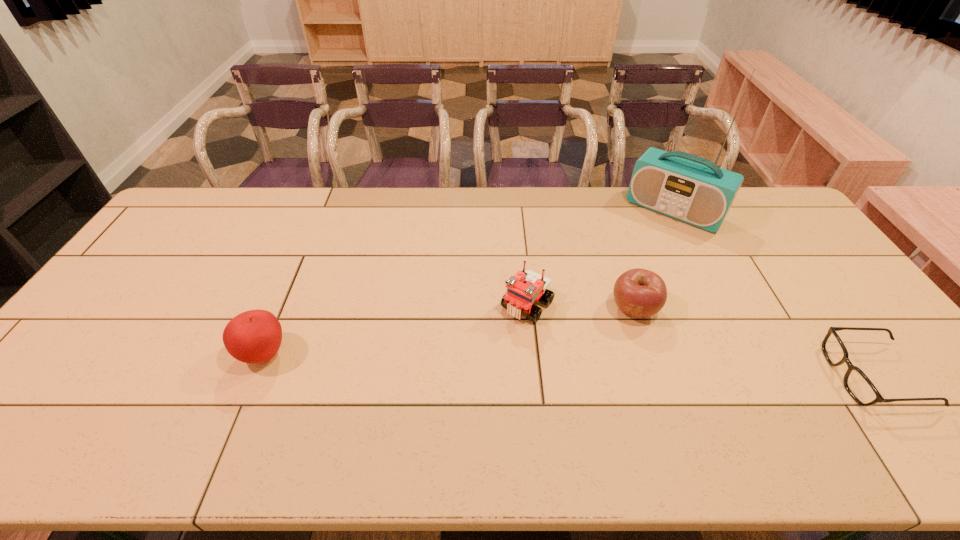
In order to click on vacant space on the desktop that is between the leftmost object and the rightmost object and is positioned on the front panel of the radio receiver in this screenshot , I will do `click(563, 364)`.

You are a GUI agent. You are given a task and a screenshot of the screen. Output one action in this format:
    pyautogui.click(x=<x>, y=<y>)
    Task: Click on the vacant space on the desktop that is between the taller apple and the rightmost object and is positioned on the side of the second shortest object with the unique marking
    The image size is (960, 540).
    Given the screenshot: What is the action you would take?
    pyautogui.click(x=577, y=365)

Find the location of a particular element. The image size is (960, 540). free space on the desktop that is between the left apple and the spectacles and is positioned on the front-facing side of the Lego is located at coordinates (481, 362).